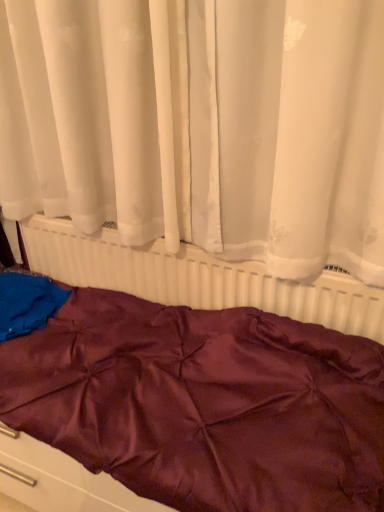
The width and height of the screenshot is (384, 512). I want to click on burgundy satin bedspread at center, so click(x=204, y=403).

Where is `burgundy satin bedspread at center`? Image resolution: width=384 pixels, height=512 pixels. burgundy satin bedspread at center is located at coordinates (204, 403).

Which is closer, (114, 250) or (304, 400)?

Point (114, 250).

Is white plastic radiator at center thinner than burgundy satin bedspread at center?

Yes, white plastic radiator at center is thinner than burgundy satin bedspread at center.

Who is bigger, white plastic radiator at center or burgundy satin bedspread at center?

burgundy satin bedspread at center.

Is white sheer curtain at upper center facing away from burgundy satin bedspread at center?

No.

From a real-world perspective, is white sheer curtain at upper center below burgundy satin bedspread at center?

Actually, white sheer curtain at upper center is physically above burgundy satin bedspread at center in the real world.

Is the position of white sheer curtain at upper center more distant than that of burgundy satin bedspread at center?

No, it is in front of burgundy satin bedspread at center.

Is white sheer curtain at upper center taller or shorter than burgundy satin bedspread at center?

In the image, white sheer curtain at upper center appears to be taller than burgundy satin bedspread at center.

Is white sheer curtain at upper center facing away from white plastic radiator at center?

white sheer curtain at upper center is not turned away from white plastic radiator at center.

Is white sheer curtain at upper center taller than white plastic radiator at center?

Indeed, white sheer curtain at upper center has a greater height compared to white plastic radiator at center.

Between white sheer curtain at upper center and white plastic radiator at center, which one appears on the left side from the viewer's perspective?

white sheer curtain at upper center is more to the left.

From the image's perspective, is white sheer curtain at upper center on white plastic radiator at center?

Indeed, from the image's perspective, white sheer curtain at upper center is shown above white plastic radiator at center.

Can you tell me how much burgundy satin bedspread at center and white plastic radiator at center differ in facing direction?

burgundy satin bedspread at center and white plastic radiator at center are facing 1.26 degrees away from each other.

Is there a large distance between burgundy satin bedspread at center and white plastic radiator at center?

No, burgundy satin bedspread at center is not far away from white plastic radiator at center.

From the picture: Does burgundy satin bedspread at center have a lesser height compared to white plastic radiator at center?

Yes, burgundy satin bedspread at center is shorter than white plastic radiator at center.

Is burgundy satin bedspread at center bigger or smaller than white plastic radiator at center?

Clearly, burgundy satin bedspread at center is larger in size than white plastic radiator at center.

Is white plastic radiator at center far away from white sheer curtain at upper center?

No, white plastic radiator at center is not far from white sheer curtain at upper center.

Is white plastic radiator at center bigger than white sheer curtain at upper center?

No.

Is white plastic radiator at center wider or thinner than white sheer curtain at upper center?

Considering their sizes, white plastic radiator at center looks slimmer than white sheer curtain at upper center.

In the image, there is a white plastic radiator at center. Where is `curtain above it (from the image's perspective)`? Image resolution: width=384 pixels, height=512 pixels. curtain above it (from the image's perspective) is located at coordinates (201, 125).

Is burgundy satin bedspread at center oriented towards white sheer curtain at upper center?

No, burgundy satin bedspread at center is not aimed at white sheer curtain at upper center.

From the picture: From a real-world perspective, is burgundy satin bedspread at center beneath white sheer curtain at upper center?

Yes, from a real-world perspective, burgundy satin bedspread at center is beneath white sheer curtain at upper center.

Between burgundy satin bedspread at center and white sheer curtain at upper center, which one has smaller width?

Thinner between the two is white sheer curtain at upper center.

Do you think burgundy satin bedspread at center is within white sheer curtain at upper center, or outside of it?

burgundy satin bedspread at center is outside white sheer curtain at upper center.

Locate an element on the screen. furniture on the left of white plastic radiator at center is located at coordinates [x=204, y=403].

Where is `curtain on the right side of burgundy satin bedspread at center`? Image resolution: width=384 pixels, height=512 pixels. curtain on the right side of burgundy satin bedspread at center is located at coordinates (201, 125).

Looking at the image, which one is located closer to white sheer curtain at upper center, white plastic radiator at center or burgundy satin bedspread at center?

Among the two, white plastic radiator at center is located nearer to white sheer curtain at upper center.

From the image, which object appears to be farther from white plastic radiator at center, burgundy satin bedspread at center or white sheer curtain at upper center?

Based on the image, white sheer curtain at upper center appears to be further to white plastic radiator at center.

Which object lies further to the anchor point burgundy satin bedspread at center, white plastic radiator at center or white sheer curtain at upper center?

white sheer curtain at upper center is further to burgundy satin bedspread at center.

When comparing their distances from white sheer curtain at upper center, does burgundy satin bedspread at center or white plastic radiator at center seem further?

burgundy satin bedspread at center is positioned further to the anchor white sheer curtain at upper center.

Which object lies nearer to the anchor point burgundy satin bedspread at center, white sheer curtain at upper center or white plastic radiator at center?

white plastic radiator at center is positioned closer to the anchor burgundy satin bedspread at center.

Which object lies nearer to the anchor point white plastic radiator at center, white sheer curtain at upper center or burgundy satin bedspread at center?

The object closer to white plastic radiator at center is burgundy satin bedspread at center.

Where is `radiator between white sheer curtain at upper center and burgundy satin bedspread at center in the vertical direction`? This screenshot has height=512, width=384. radiator between white sheer curtain at upper center and burgundy satin bedspread at center in the vertical direction is located at coordinates (198, 278).